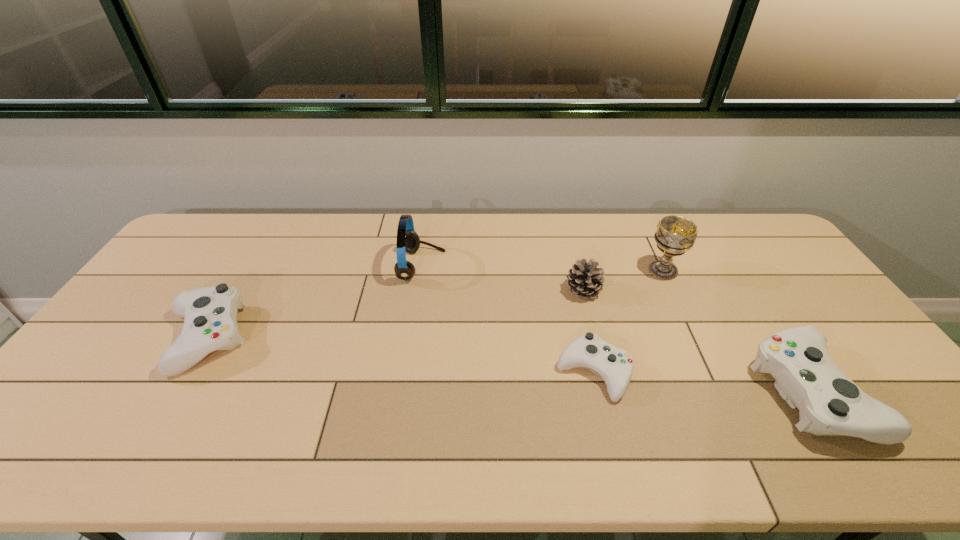
In the image, there is a desktop. In order to click on vacant region at the left edge in this screenshot , I will do `click(119, 360)`.

Locate an element on the screen. vacant region at the right edge of the desktop is located at coordinates (794, 326).

Where is `vacant space at the far left corner of the desktop`? vacant space at the far left corner of the desktop is located at coordinates (220, 237).

I want to click on unoccupied area between the chalice and the rightmost object, so click(x=736, y=331).

This screenshot has height=540, width=960. In order to click on free area in between the headset and the fifth object from left to right in this screenshot , I will do `click(542, 268)`.

You are a GUI agent. You are given a task and a screenshot of the screen. Output one action in this format:
    pyautogui.click(x=<x>, y=<y>)
    Task: Click on the vacant space that is in between the second control from right to left and the pinecone
    The width and height of the screenshot is (960, 540).
    Given the screenshot: What is the action you would take?
    pyautogui.click(x=588, y=332)

Where is `free space between the headset and the pinecone`? The image size is (960, 540). free space between the headset and the pinecone is located at coordinates (502, 278).

In order to click on unoccupied position between the second object from right to left and the second control from right to left in this screenshot , I will do `click(629, 322)`.

I want to click on free space between the second control from left to right and the pinecone, so click(588, 332).

Where is `free space between the second object from left to right and the rightmost control`? The image size is (960, 540). free space between the second object from left to right and the rightmost control is located at coordinates (616, 329).